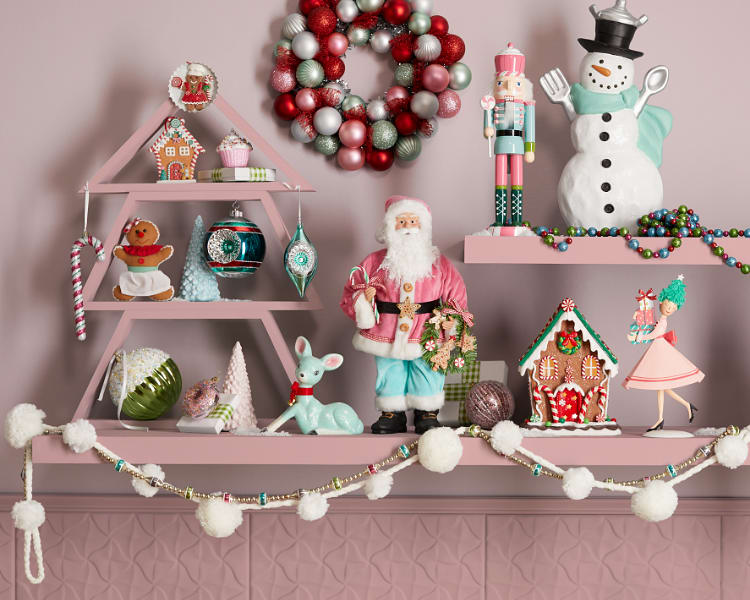
Where is `cabinet`? Image resolution: width=750 pixels, height=600 pixels. cabinet is located at coordinates (668, 548).